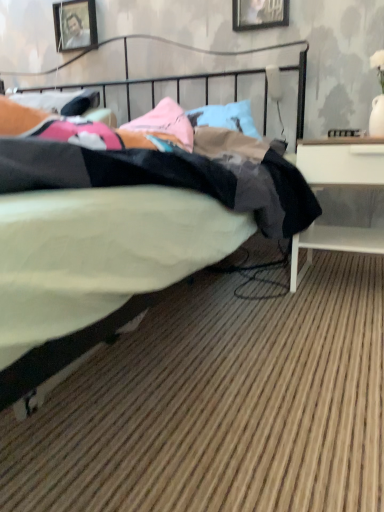
Question: Does white matte desk at right appear on the right side of wooden picture frame at upper left, which is the 1th picture frame in back-to-front order?

Choices:
 (A) no
 (B) yes

Answer: (B)

Question: From the image's perspective, is white matte desk at right located beneath wooden picture frame at upper left, which is counted as the second picture frame, starting from the front?

Choices:
 (A) no
 (B) yes

Answer: (B)

Question: Is white matte desk at right completely or partially outside of wooden picture frame at upper left, which is counted as the second picture frame, starting from the front?

Choices:
 (A) yes
 (B) no

Answer: (A)

Question: Is white matte desk at right with wooden picture frame at upper left, which is counted as the second picture frame, starting from the right?

Choices:
 (A) yes
 (B) no

Answer: (B)

Question: Does white matte desk at right have a lesser width compared to wooden picture frame at upper left, which is the 1th picture frame in back-to-front order?

Choices:
 (A) no
 (B) yes

Answer: (A)

Question: Can you confirm if white matte desk at right is shorter than wooden picture frame at upper left, which is counted as the second picture frame, starting from the front?

Choices:
 (A) yes
 (B) no

Answer: (B)

Question: Is white matte desk at right shorter than black fabric bed at center?

Choices:
 (A) yes
 (B) no

Answer: (A)

Question: Does white matte desk at right have a greater height compared to black fabric bed at center?

Choices:
 (A) yes
 (B) no

Answer: (B)

Question: Is white matte desk at right at the right side of black fabric bed at center?

Choices:
 (A) yes
 (B) no

Answer: (A)

Question: Is white matte desk at right placed right next to black fabric bed at center?

Choices:
 (A) yes
 (B) no

Answer: (B)

Question: Is white matte desk at right positioned with its back to black fabric bed at center?

Choices:
 (A) yes
 (B) no

Answer: (B)

Question: Is white matte desk at right aimed at black fabric bed at center?

Choices:
 (A) yes
 (B) no

Answer: (B)

Question: Considering the relative positions of wooden picture frame at upper center, the 2th picture frame positioned from the left, and wooden picture frame at upper left, which is counted as the second picture frame, starting from the right, in the image provided, is wooden picture frame at upper center, the 2th picture frame positioned from the left, to the left of wooden picture frame at upper left, which is counted as the second picture frame, starting from the right, from the viewer's perspective?

Choices:
 (A) yes
 (B) no

Answer: (B)